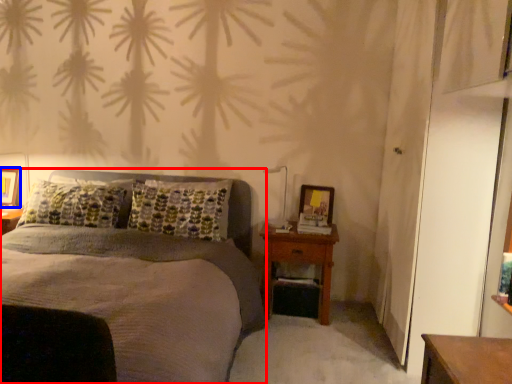
Question: Which point is closer to the camera, bed (highlighted by a red box) or picture frame (highlighted by a blue box)?

Choices:
 (A) bed
 (B) picture frame

Answer: (A)